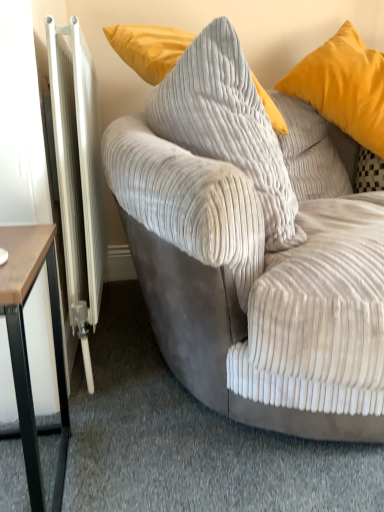
Identify the location of brown wood table at left. (26, 348).

Where is `velvet gray couch at center`? This screenshot has height=512, width=384. velvet gray couch at center is located at coordinates (251, 253).

How many degrees apart are the facing directions of corduroy pillow at center, which is the 2th pillow in right-to-left order, and white metallic radiator at left?

The angular difference between corduroy pillow at center, which is the 2th pillow in right-to-left order, and white metallic radiator at left is 11.6 degrees.

Considering the sizes of corduroy pillow at center, acting as the first pillow starting from the left, and white metallic radiator at left in the image, is corduroy pillow at center, acting as the first pillow starting from the left, taller or shorter than white metallic radiator at left?

corduroy pillow at center, acting as the first pillow starting from the left, is shorter than white metallic radiator at left.

How distant is corduroy pillow at center, which is the 2th pillow in right-to-left order, from white metallic radiator at left?

corduroy pillow at center, which is the 2th pillow in right-to-left order, is 11.43 inches away from white metallic radiator at left.

Which object is further away from the camera taking this photo, corduroy pillow at center, acting as the first pillow starting from the left, or white metallic radiator at left?

white metallic radiator at left is more distant.

What's the angular difference between matte yellow pillow at upper right, positioned as the 2th pillow in left-to-right order, and white metallic radiator at left's facing directions?

matte yellow pillow at upper right, positioned as the 2th pillow in left-to-right order, and white metallic radiator at left are facing 103 degrees away from each other.

Could you measure the distance between matte yellow pillow at upper right, positioned as the 2th pillow in left-to-right order, and white metallic radiator at left?

The distance of matte yellow pillow at upper right, positioned as the 2th pillow in left-to-right order, from white metallic radiator at left is 33.09 inches.

Looking at their sizes, would you say matte yellow pillow at upper right, which appears as the first pillow when viewed from the right, is wider or thinner than white metallic radiator at left?

Clearly, matte yellow pillow at upper right, which appears as the first pillow when viewed from the right, has more width compared to white metallic radiator at left.

Which is closer to the camera, [361,134] or [95,280]?

Positioned in front is point [95,280].

From a real-world perspective, is velvet gray couch at center physically located above or below white metallic radiator at left?

velvet gray couch at center is above white metallic radiator at left.

Based on the photo, measure the distance between velvet gray couch at center and white metallic radiator at left.

They are 13.32 inches apart.

Which is behind, velvet gray couch at center or white metallic radiator at left?

white metallic radiator at left.

Would you say velvet gray couch at center is to the left or to the right of white metallic radiator at left in the picture?

Based on their positions, velvet gray couch at center is located to the right of white metallic radiator at left.

Choose the correct answer: Is corduroy pillow at center, which is the 2th pillow in right-to-left order, inside velvet gray couch at center or outside it?

corduroy pillow at center, which is the 2th pillow in right-to-left order, lies within the bounds of velvet gray couch at center.

Is corduroy pillow at center, acting as the first pillow starting from the left, looking in the opposite direction of velvet gray couch at center?

Yes, corduroy pillow at center, acting as the first pillow starting from the left,'s orientation is away from velvet gray couch at center.

Which is in front, corduroy pillow at center, which is the 2th pillow in right-to-left order, or velvet gray couch at center?

velvet gray couch at center.

From the image's perspective, relative to velvet gray couch at center, is corduroy pillow at center, which is the 2th pillow in right-to-left order, above or below?

From the image's perspective, corduroy pillow at center, which is the 2th pillow in right-to-left order, appears above velvet gray couch at center.

The image size is (384, 512). In order to click on the 1st pillow counting from the right of the white metallic radiator at left in this screenshot , I will do `click(227, 124)`.

From the image's perspective, does white metallic radiator at left appear higher than corduroy pillow at center, which is the 2th pillow in right-to-left order?

No, from the image's perspective, white metallic radiator at left is not above corduroy pillow at center, which is the 2th pillow in right-to-left order.

Is white metallic radiator at left in front of or behind corduroy pillow at center, which is the 2th pillow in right-to-left order, in the image?

white metallic radiator at left is positioned farther from the viewer than corduroy pillow at center, which is the 2th pillow in right-to-left order.

Is white metallic radiator at left facing away from corduroy pillow at center, acting as the first pillow starting from the left?

No, corduroy pillow at center, acting as the first pillow starting from the left, is not at the back of white metallic radiator at left.

Between corduroy pillow at center, which is the 2th pillow in right-to-left order, and brown wood table at left, which one appears on the right side from the viewer's perspective?

From the viewer's perspective, corduroy pillow at center, which is the 2th pillow in right-to-left order, appears more on the right side.

Considering the relative positions of corduroy pillow at center, acting as the first pillow starting from the left, and brown wood table at left in the image provided, is corduroy pillow at center, acting as the first pillow starting from the left, behind brown wood table at left?

Yes, the depth of corduroy pillow at center, acting as the first pillow starting from the left, is greater than that of brown wood table at left.

Find the location of a particular element. table on the left side of corduroy pillow at center, which is the 2th pillow in right-to-left order is located at coordinates (26, 348).

From a real-world perspective, is velvet gray couch at center under matte yellow pillow at upper right, which appears as the first pillow when viewed from the right?

Indeed, from a real-world perspective, velvet gray couch at center is positioned beneath matte yellow pillow at upper right, which appears as the first pillow when viewed from the right.

Which object is positioned more to the left, velvet gray couch at center or matte yellow pillow at upper right, positioned as the 2th pillow in left-to-right order?

Positioned to the left is velvet gray couch at center.

Does velvet gray couch at center lie in front of matte yellow pillow at upper right, which appears as the first pillow when viewed from the right?

Yes, velvet gray couch at center is in front of matte yellow pillow at upper right, which appears as the first pillow when viewed from the right.

I want to click on radiator on the left of corduroy pillow at center, acting as the first pillow starting from the left, so click(x=78, y=177).

Where is `the 2nd pillow above the white metallic radiator at left (from a real-world perspective)`? Image resolution: width=384 pixels, height=512 pixels. the 2nd pillow above the white metallic radiator at left (from a real-world perspective) is located at coordinates (343, 86).

Considering their positions, is white metallic radiator at left positioned closer to matte yellow pillow at upper right, which appears as the first pillow when viewed from the right, than corduroy pillow at center, which is the 2th pillow in right-to-left order?

corduroy pillow at center, which is the 2th pillow in right-to-left order, is closer to matte yellow pillow at upper right, which appears as the first pillow when viewed from the right.

From the image, which object appears to be farther from velvet gray couch at center, matte yellow pillow at upper right, positioned as the 2th pillow in left-to-right order, or white metallic radiator at left?

The object further to velvet gray couch at center is matte yellow pillow at upper right, positioned as the 2th pillow in left-to-right order.

When comparing their distances from brown wood table at left, does matte yellow pillow at upper right, positioned as the 2th pillow in left-to-right order, or corduroy pillow at center, acting as the first pillow starting from the left, seem further?

The object further to brown wood table at left is matte yellow pillow at upper right, positioned as the 2th pillow in left-to-right order.

Looking at the image, which one is located further to matte yellow pillow at upper right, positioned as the 2th pillow in left-to-right order, brown wood table at left or white metallic radiator at left?

brown wood table at left lies further to matte yellow pillow at upper right, positioned as the 2th pillow in left-to-right order, than the other object.

Based on their spatial positions, is corduroy pillow at center, acting as the first pillow starting from the left, or brown wood table at left closer to matte yellow pillow at upper right, which appears as the first pillow when viewed from the right?

The object closer to matte yellow pillow at upper right, which appears as the first pillow when viewed from the right, is corduroy pillow at center, acting as the first pillow starting from the left.

Based on their spatial positions, is brown wood table at left or white metallic radiator at left further from velvet gray couch at center?

The object further to velvet gray couch at center is brown wood table at left.

From the image, which object appears to be nearer to velvet gray couch at center, matte yellow pillow at upper right, positioned as the 2th pillow in left-to-right order, or brown wood table at left?

Among the two, brown wood table at left is located nearer to velvet gray couch at center.

Which object lies further to the anchor point white metallic radiator at left, matte yellow pillow at upper right, which appears as the first pillow when viewed from the right, or brown wood table at left?

Based on the image, matte yellow pillow at upper right, which appears as the first pillow when viewed from the right, appears to be further to white metallic radiator at left.

You are a GUI agent. You are given a task and a screenshot of the screen. Output one action in this format:
    pyautogui.click(x=<x>, y=<y>)
    Task: Click on the table between velvet gray couch at center and matte yellow pillow at upper right, positioned as the 2th pillow in left-to-right order, along the z-axis
    
    Given the screenshot: What is the action you would take?
    pyautogui.click(x=26, y=348)

What are the coordinates of `pillow situated between white metallic radiator at left and velvet gray couch at center from left to right` in the screenshot? It's located at click(x=227, y=124).

Where is `pillow situated between white metallic radiator at left and matte yellow pillow at upper right, positioned as the 2th pillow in left-to-right order, from left to right`? The height and width of the screenshot is (512, 384). pillow situated between white metallic radiator at left and matte yellow pillow at upper right, positioned as the 2th pillow in left-to-right order, from left to right is located at coordinates (227, 124).

I want to click on table located between white metallic radiator at left and velvet gray couch at center in the left-right direction, so click(26, 348).